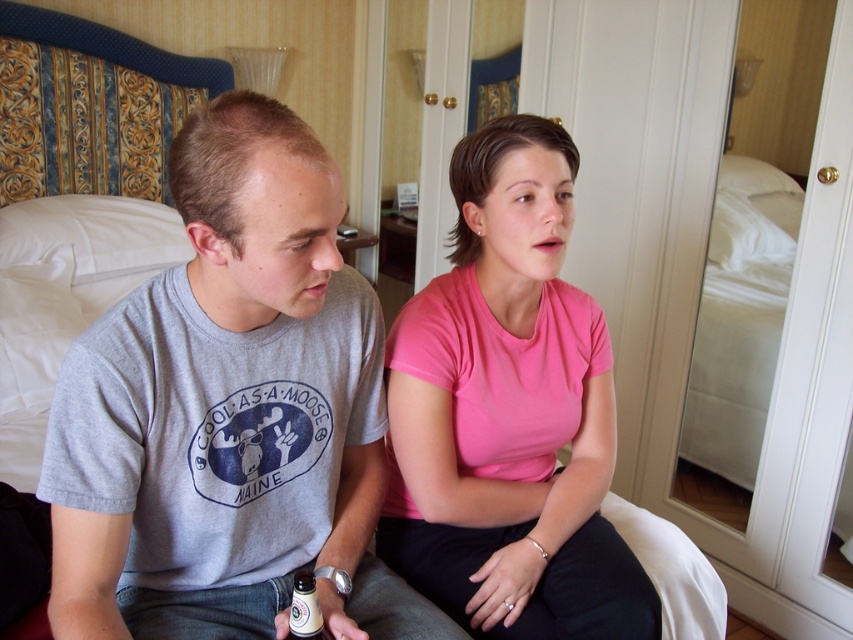
Does gray cotton t-shirt at left appear over pink cotton shirt at center?

No.

Does gray cotton t-shirt at left have a lesser height compared to pink cotton shirt at center?

Yes, gray cotton t-shirt at left is shorter than pink cotton shirt at center.

Where is `gray cotton t-shirt at left`? This screenshot has width=853, height=640. gray cotton t-shirt at left is located at coordinates (229, 413).

Who is positioned more to the right, pink cotton shirt at center or translucent plastic bottle at lower center?

Positioned to the right is pink cotton shirt at center.

What do you see at coordinates (508, 413) in the screenshot?
I see `pink cotton shirt at center` at bounding box center [508, 413].

Find the location of `pink cotton shirt at center`. pink cotton shirt at center is located at coordinates (508, 413).

Is gray cotton t-shirt at left bigger than translucent plastic bottle at lower center?

Yes, gray cotton t-shirt at left is bigger than translucent plastic bottle at lower center.

What do you see at coordinates (229, 413) in the screenshot?
I see `gray cotton t-shirt at left` at bounding box center [229, 413].

You are a GUI agent. You are given a task and a screenshot of the screen. Output one action in this format:
    pyautogui.click(x=<x>, y=<y>)
    Task: Click on the gray cotton t-shirt at left
    The image size is (853, 640).
    Given the screenshot: What is the action you would take?
    pyautogui.click(x=229, y=413)